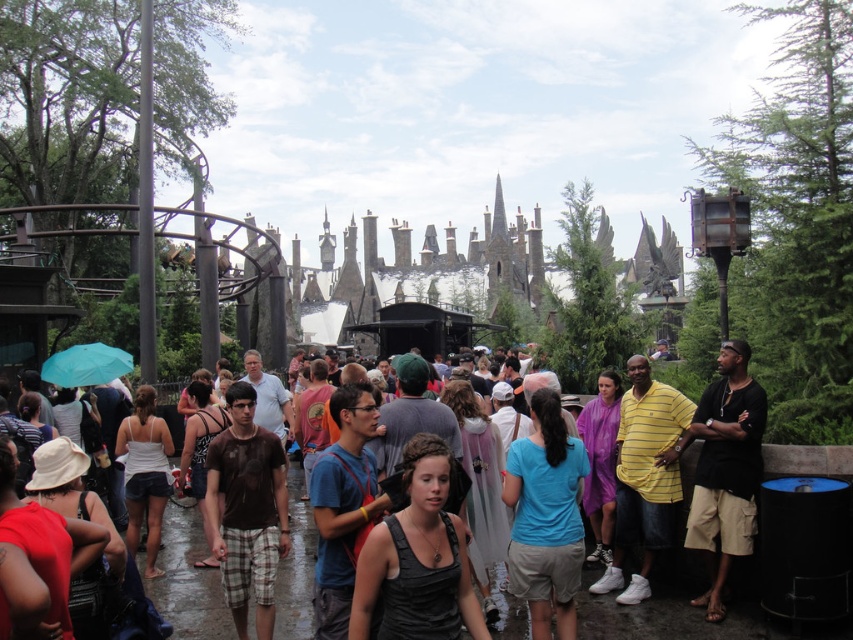
This screenshot has width=853, height=640. What do you see at coordinates (200, 451) in the screenshot?
I see `dark brown leather backpack at center` at bounding box center [200, 451].

Who is shorter, dark brown leather backpack at center or teal fabric umbrella at lower left?

teal fabric umbrella at lower left is shorter.

Find the location of a particular element. The width and height of the screenshot is (853, 640). dark brown leather backpack at center is located at coordinates (200, 451).

Between blue fabric shirt at center and dark brown leather backpack at center, which one appears on the left side from the viewer's perspective?

dark brown leather backpack at center

Is blue fabric shirt at center in front of dark brown leather backpack at center?

That is True.

Is point (567, 614) positioned behind point (204, 445)?

No, it is in front of (204, 445).

The image size is (853, 640). Find the location of `blue fabric shirt at center`. blue fabric shirt at center is located at coordinates 544,516.

Can you confirm if black matte tank top at center is positioned below blue fabric shirt at center?

Correct, black matte tank top at center is located below blue fabric shirt at center.

Who is positioned more to the right, black matte tank top at center or blue fabric shirt at center?

blue fabric shirt at center is more to the right.

In order to click on black matte tank top at center in this screenshot , I will do `click(416, 557)`.